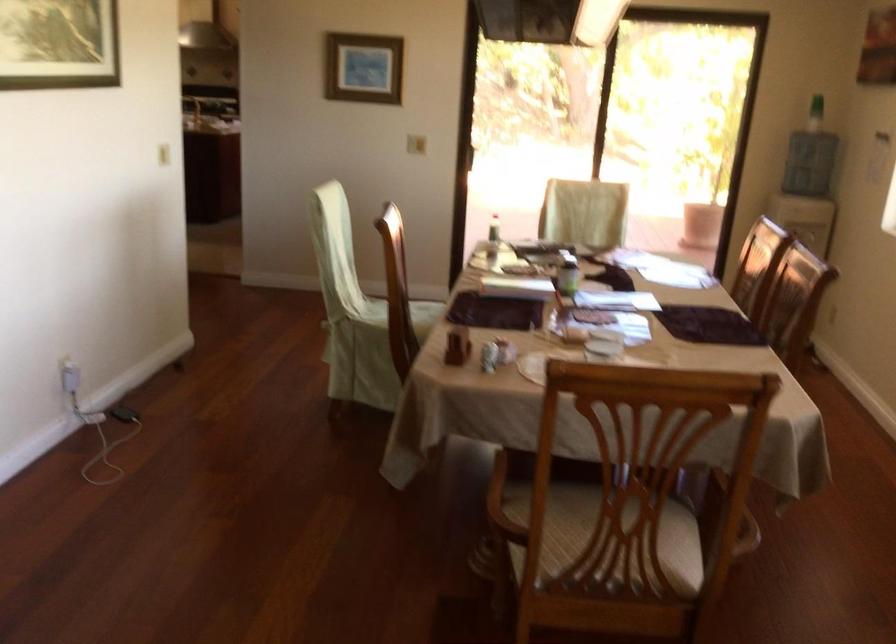
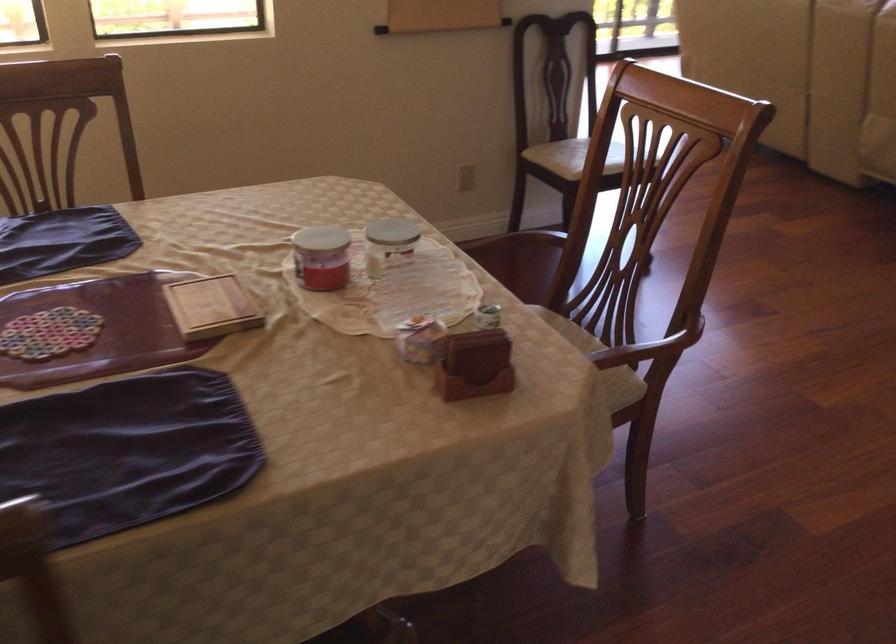
Locate, in the second image, the point that corresponds to the point at 604,342 in the first image.

(321, 257)